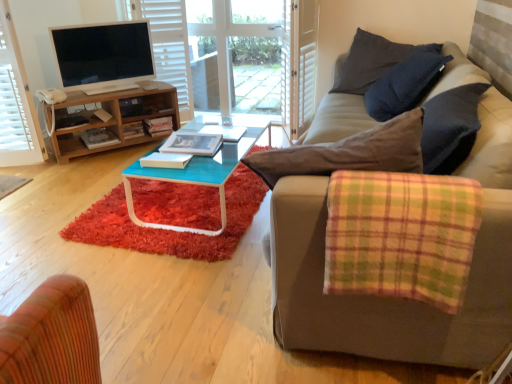
You are a GUI agent. You are given a task and a screenshot of the screen. Output one action in this format:
    pyautogui.click(x=<x>, y=<y>)
    Task: Click on the free point below white plastic phone at left (from a real-world perspective)
    The width and height of the screenshot is (512, 384).
    Given the screenshot: What is the action you would take?
    pyautogui.click(x=54, y=96)